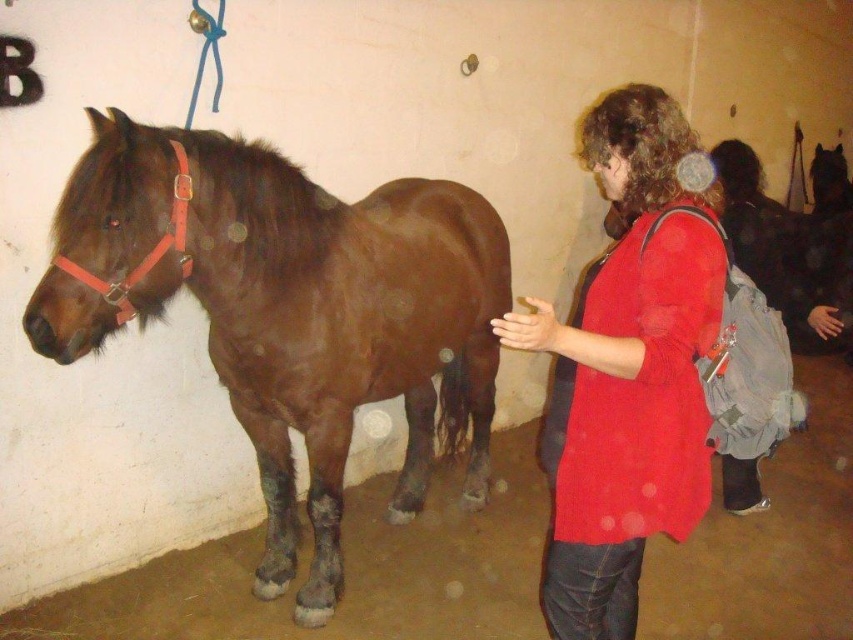
You are standing in the room and see the point marked at coordinates (288,308). Which object in the scene does this point lie on?

The point marked at coordinates (288,308) lies on the brown glossy horse at left.

You are an animal trainer assessing the space needed for a horse and a person. Based on the scene, can the brown glossy horse at left and the matte red shirt at center be accommodated in a 3x3 meter area together?

The brown glossy horse at left is larger in size than the matte red shirt at center. Since the horse is bigger, it may require more space, but the total area of 3x3 meters might be sufficient if they are positioned carefully.